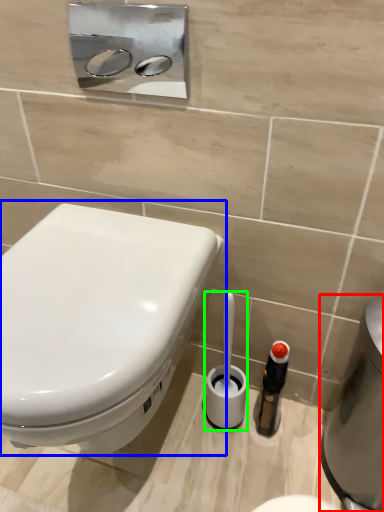
Question: Based on their relative distances, which object is nearer to water heater (highlighted by a red box)? Choose from toilet (highlighted by a blue box) and brush (highlighted by a green box).

Choices:
 (A) toilet
 (B) brush

Answer: (B)